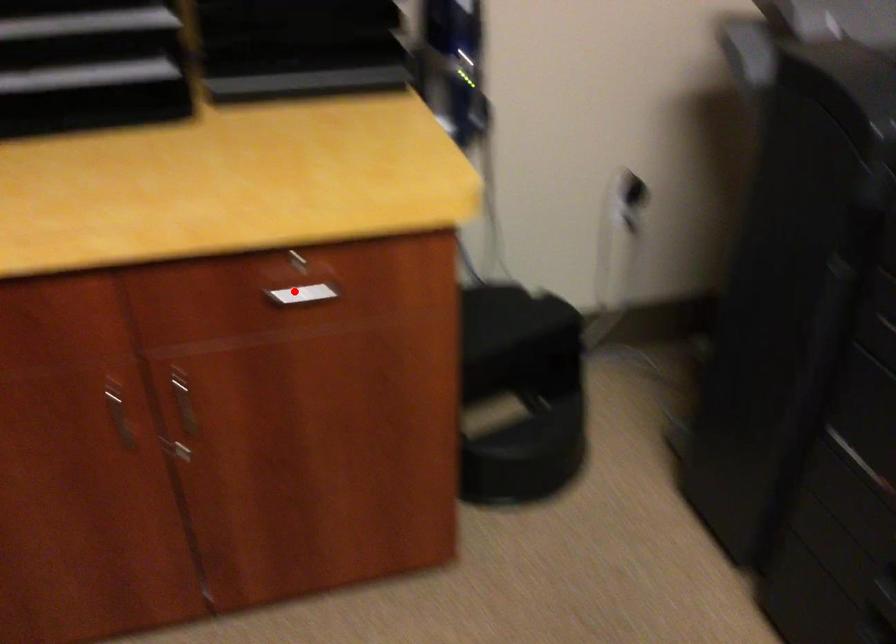
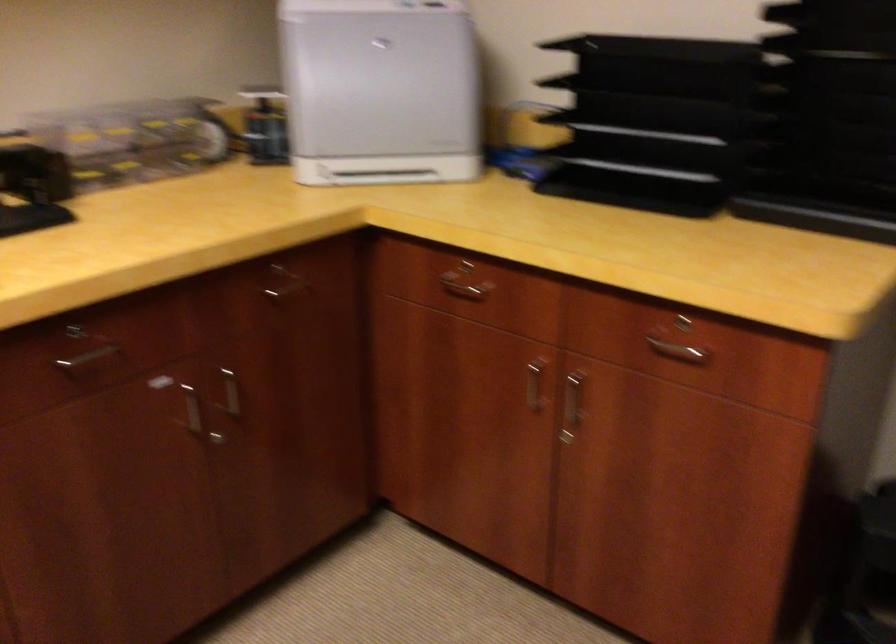
Question: A red point is marked in image1. In image2, is the corresponding 3D point closer to the camera or farther? Reply with the corresponding letter.

Choices:
 (A) The corresponding 3D point is closer.
 (B) The corresponding 3D point is farther.

Answer: (B)